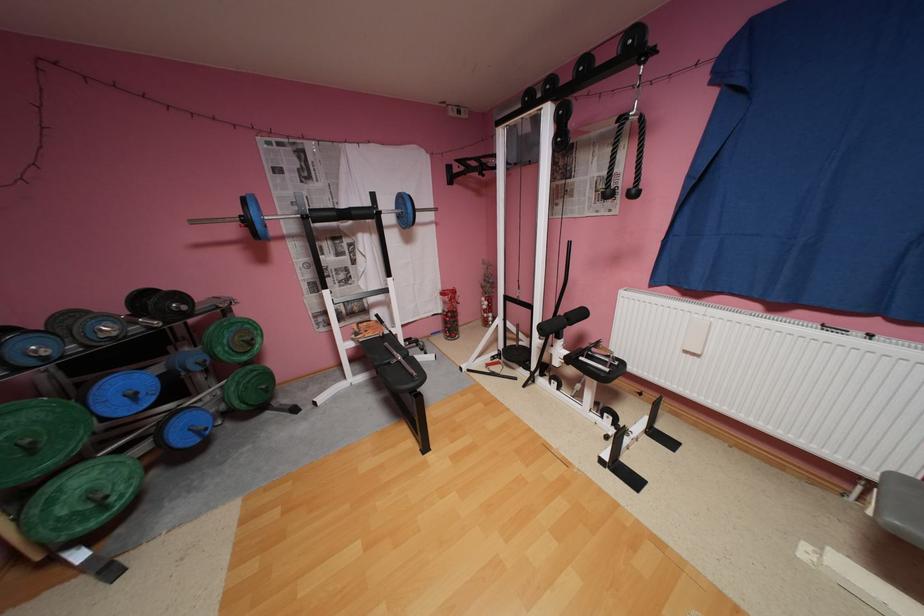
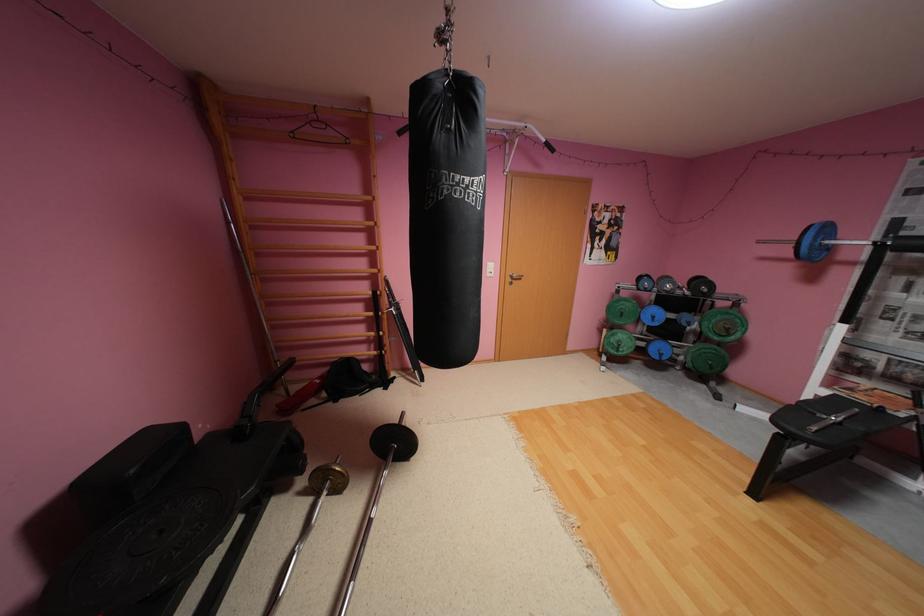
Locate, in the second image, the point that corresponds to [261,345] in the first image.

(737, 334)